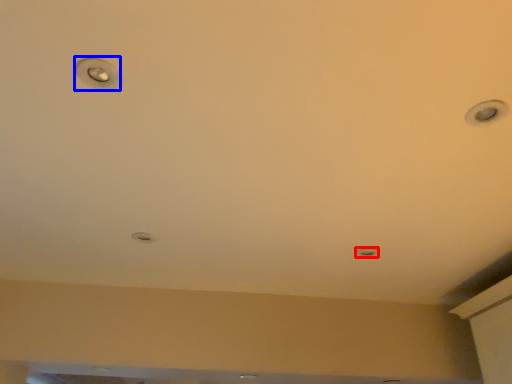
Question: Which object is closer to the camera taking this photo, light (highlighted by a red box) or droplight (highlighted by a blue box)?

Choices:
 (A) light
 (B) droplight

Answer: (B)